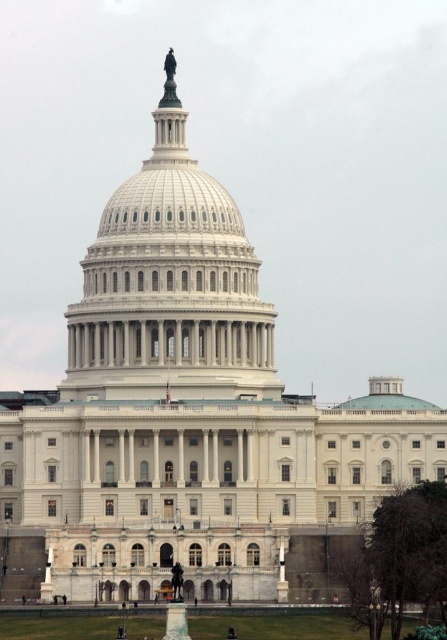
Can you confirm if white marble dome at center is shorter than clear glass dome at center?

No.

Does white marble dome at center appear over clear glass dome at center?

Yes.

Does point (172, 246) come farther from viewer compared to point (386, 380)?

That is False.

The image size is (447, 640). Identify the location of white marble dome at center. (169, 285).